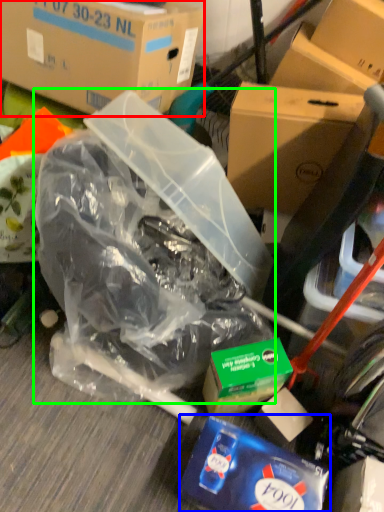
Question: Considering the real-world distances, which object is farthest from box (highlighted by a red box)? waste (highlighted by a blue box) or plastic bag (highlighted by a green box)?

Choices:
 (A) waste
 (B) plastic bag

Answer: (A)